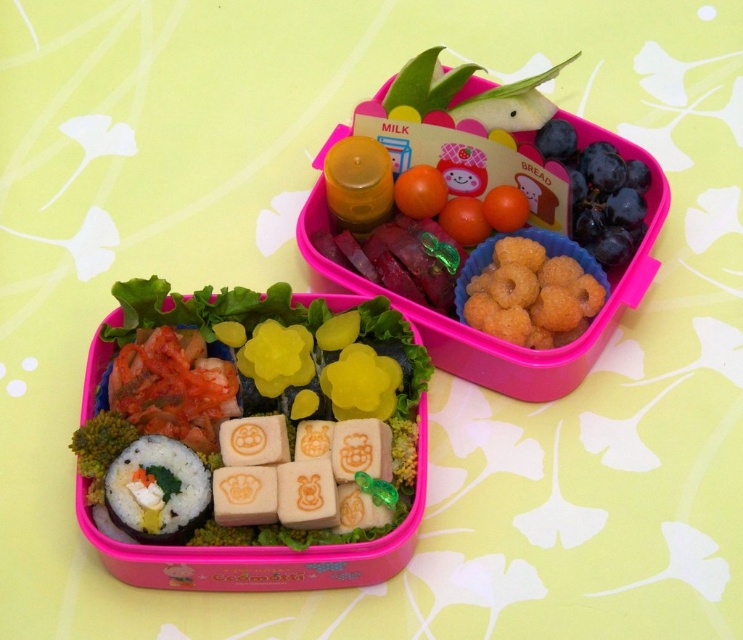
Can you confirm if white rice with sushi at lower left is smaller than white rice with fish filling at lower left?

No, white rice with sushi at lower left is not smaller than white rice with fish filling at lower left.

Does white rice with sushi at lower left have a lesser width compared to white rice with fish filling at lower left?

No, white rice with sushi at lower left is not thinner than white rice with fish filling at lower left.

This screenshot has height=640, width=743. In order to click on white rice with sushi at lower left in this screenshot , I will do (x=509, y=342).